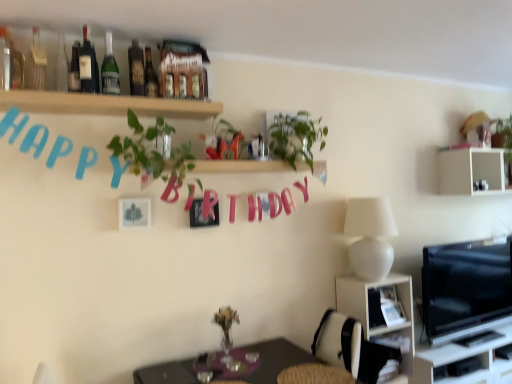
Find the location of a particular element. green leafy plant at upper center is located at coordinates (295, 137).

What do you see at coordinates (11, 62) in the screenshot? This screenshot has height=384, width=512. I see `matte glass bottle at upper left, the 8th bottle when ordered from right to left` at bounding box center [11, 62].

The height and width of the screenshot is (384, 512). In order to click on black glossy tv at right in this screenshot , I will do (x=466, y=287).

This screenshot has height=384, width=512. Identify the location of matte glass bottle at upper left, arranged as the 4th bottle when viewed from the right. (88, 66).

Measure the distance between point [88,84] and camera.

6.55 feet.

In order to click on matte black tv stand at right, which is the second shelf in right-to-left order in this screenshot , I will do `click(466, 359)`.

This screenshot has width=512, height=384. Find the location of `wooden table at lower center`. wooden table at lower center is located at coordinates 274,360.

You are a GUI agent. You are given a task and a screenshot of the screen. Output one action in this format:
    pyautogui.click(x=<x>, y=<y>)
    Task: Click on the white plastic shelf at lower right, acting as the second shelf starting from the left
    The height and width of the screenshot is (384, 512).
    Given the screenshot: What is the action you would take?
    pyautogui.click(x=382, y=313)

Which object is closer to the camera taking this photo, matte black tv stand at right, the fourth shelf when ordered from top to bottom, or black glossy tv at right?

matte black tv stand at right, the fourth shelf when ordered from top to bottom, is in front.

Which is nearer, (472,369) or (426,335)?

The point (426,335) is closer to the camera.

Does matte black tv stand at right, acting as the third shelf starting from the left, appear on the right side of black glossy tv at right?

No, matte black tv stand at right, acting as the third shelf starting from the left, is not to the right of black glossy tv at right.

Find the location of a particular element. television behind the matte black tv stand at right, acting as the third shelf starting from the left is located at coordinates click(x=466, y=287).

From the image's perspective, starting from the shiny dark glass bottle at upper center, which is counted as the eighth bottle, starting from the left, which bottle is the 3rd one above? Please provide its 2D coordinates.

[(110, 69)]

From the image's perspective, does green glass bottle at upper left, which ranks as the 3th bottle in right-to-left order, appear higher than shiny dark glass bottle at upper center, which is counted as the eighth bottle, starting from the left?

Indeed, from the image's perspective, green glass bottle at upper left, which ranks as the 3th bottle in right-to-left order, is shown above shiny dark glass bottle at upper center, which is counted as the eighth bottle, starting from the left.

Which is more to the left, white plastic shelf at lower right, positioned as the 2th shelf in bottom-to-top order, or clear glass bottle at upper left, which is counted as the 6th bottle, starting from the right?

clear glass bottle at upper left, which is counted as the 6th bottle, starting from the right.

From the clear glass bottle at upper left, which is counted as the 6th bottle, starting from the right, count 1st shelfs backward and point to it. Please provide its 2D coordinates.

[(382, 313)]

From the image's perspective, is white plastic shelf at lower right, acting as the second shelf starting from the left, beneath clear glass bottle at upper left, which is counted as the 6th bottle, starting from the right?

Correct, white plastic shelf at lower right, acting as the second shelf starting from the left, appears lower than clear glass bottle at upper left, which is counted as the 6th bottle, starting from the right, in the image.

This screenshot has width=512, height=384. In the image, there is a matte glass bottle at upper left, the 4th bottle viewed from the left. What are the coordinates of `table below it (from the image's perspective)` in the screenshot? It's located at (274, 360).

Is matte glass bottle at upper left, the 4th bottle viewed from the left, oriented away from wooden table at lower center?

No, wooden table at lower center is not at the back of matte glass bottle at upper left, the 4th bottle viewed from the left.

From the image's perspective, who appears lower, matte glass bottle at upper left, which appears as the 5th bottle when viewed from the right, or wooden table at lower center?

wooden table at lower center is shown below in the image.

Is matte glass bottle at upper left, the 4th bottle viewed from the left, positioned beyond the bounds of wooden table at lower center?

Yes, matte glass bottle at upper left, the 4th bottle viewed from the left, is located beyond the bounds of wooden table at lower center.

Looking at their sizes, would you say matte glass bottle at upper left, the 8th bottle when ordered from right to left, is wider or thinner than clear glass bottle at upper left, the 7th bottle when ordered from right to left?

Considering their sizes, matte glass bottle at upper left, the 8th bottle when ordered from right to left, looks broader than clear glass bottle at upper left, the 7th bottle when ordered from right to left.

Which object is further away from the camera, matte glass bottle at upper left, the first bottle positioned from the left, or clear glass bottle at upper left, the 7th bottle when ordered from right to left?

Positioned behind is matte glass bottle at upper left, the first bottle positioned from the left.

Looking at this image, from a real-world perspective, is matte glass bottle at upper left, the 8th bottle when ordered from right to left, above or below clear glass bottle at upper left, the 7th bottle when ordered from right to left?

matte glass bottle at upper left, the 8th bottle when ordered from right to left, is situated higher than clear glass bottle at upper left, the 7th bottle when ordered from right to left, in the real world.

From the image's perspective, is matte glass bottle at upper left, the 8th bottle when ordered from right to left, above clear glass bottle at upper left, the 7th bottle when ordered from right to left?

Yes, from the image's perspective, matte glass bottle at upper left, the 8th bottle when ordered from right to left, is over clear glass bottle at upper left, the 7th bottle when ordered from right to left.

Based on the photo, from the image's perspective, who appears lower, white matte table lamp at right or white matte shelf at upper right, which ranks as the 1th shelf in right-to-left order?

white matte table lamp at right.

Is white matte table lamp at right bigger than white matte shelf at upper right, positioned as the 2th shelf in top-to-bottom order?

No, white matte table lamp at right is not bigger than white matte shelf at upper right, positioned as the 2th shelf in top-to-bottom order.

Is white matte table lamp at right positioned with its back to white matte shelf at upper right, which ranks as the 1th shelf in right-to-left order?

white matte table lamp at right is not turned away from white matte shelf at upper right, which ranks as the 1th shelf in right-to-left order.

Would you say white matte table lamp at right is inside or outside white matte shelf at upper right, the 3th shelf when ordered from bottom to top?

white matte table lamp at right is located beyond the bounds of white matte shelf at upper right, the 3th shelf when ordered from bottom to top.

Consider the image. Considering the sizes of objects green glass bottle at upper left, which ranks as the 3th bottle in right-to-left order, and green leafy plant at upper center in the image provided, who is smaller, green glass bottle at upper left, which ranks as the 3th bottle in right-to-left order, or green leafy plant at upper center?

With smaller size is green glass bottle at upper left, which ranks as the 3th bottle in right-to-left order.

Is green glass bottle at upper left, which appears as the 6th bottle when viewed from the left, positioned far away from green leafy plant at upper center?

green glass bottle at upper left, which appears as the 6th bottle when viewed from the left, is actually quite close to green leafy plant at upper center.

Is green glass bottle at upper left, which ranks as the 3th bottle in right-to-left order, turned away from green leafy plant at upper center?

No, green glass bottle at upper left, which ranks as the 3th bottle in right-to-left order, is not facing the opposite direction of green leafy plant at upper center.

Is green glass bottle at upper left, which ranks as the 3th bottle in right-to-left order, outside of green leafy plant at upper center?

green glass bottle at upper left, which ranks as the 3th bottle in right-to-left order, is positioned outside green leafy plant at upper center.

This screenshot has height=384, width=512. I want to click on television located on the right of matte black tv stand at right, which is the second shelf in right-to-left order, so click(466, 287).

From the image's perspective, which bottle is the 3rd one above the shiny dark glass bottle at upper center, which is counted as the eighth bottle, starting from the left? Please provide its 2D coordinates.

[(110, 69)]

When comparing their distances from matte glass bottle at upper left, which appears as the 5th bottle when viewed from the right, does matte black bottle at upper center, the second bottle viewed from the right, or wooden table at lower center seem further?

wooden table at lower center.

Which object lies nearer to the anchor point clear glass bottle at upper left, which is counted as the 6th bottle, starting from the right, white matte shelf at upper right, which ranks as the 4th shelf in left-to-right order, or wooden table at lower center?

wooden table at lower center.

Looking at the image, which one is located closer to white matte shelf at upper right, positioned as the 2th shelf in top-to-bottom order, matte glass bottle at upper left, which appears as the 5th bottle when viewed from the right, or wooden shelf at upper center, the 1th shelf when ordered from top to bottom?

Among the two, wooden shelf at upper center, the 1th shelf when ordered from top to bottom, is located nearer to white matte shelf at upper right, positioned as the 2th shelf in top-to-bottom order.

From the picture: Estimate the real-world distances between objects in this image. Which object is closer to wooden shelf at upper center, arranged as the 4th shelf when ordered from the bottom, clear glass bottle at upper left, the 7th bottle when ordered from right to left, or wooden table at lower center?

Among the two, clear glass bottle at upper left, the 7th bottle when ordered from right to left, is located nearer to wooden shelf at upper center, arranged as the 4th shelf when ordered from the bottom.

From the image, which object appears to be nearer to green glass bottle at upper left, which ranks as the 3th bottle in right-to-left order, wooden table at lower center or white matte shelf at upper right, which ranks as the 4th shelf in left-to-right order?

wooden table at lower center is positioned closer to the anchor green glass bottle at upper left, which ranks as the 3th bottle in right-to-left order.

Estimate the real-world distances between objects in this image. Which object is closer to green glass bottle at upper left, which appears as the 6th bottle when viewed from the left, matte glass bottle at upper left, the 4th bottle viewed from the left, or clear glass bottle at upper left, which is counted as the 6th bottle, starting from the right?

The object closer to green glass bottle at upper left, which appears as the 6th bottle when viewed from the left, is matte glass bottle at upper left, the 4th bottle viewed from the left.

Looking at the image, which one is located closer to matte glass bottle at upper left, which appears as the 5th bottle when viewed from the right, white plastic shelf at lower right, acting as the second shelf starting from the left, or matte glass bottle at upper left, the 8th bottle when ordered from right to left?

The object closer to matte glass bottle at upper left, which appears as the 5th bottle when viewed from the right, is matte glass bottle at upper left, the 8th bottle when ordered from right to left.

Based on their spatial positions, is shiny dark glass bottle at upper center, which is counted as the eighth bottle, starting from the left, or matte black tv stand at right, acting as the third shelf starting from the left, further from wooden shelf at upper center, which ranks as the 4th shelf in right-to-left order?

The object further to wooden shelf at upper center, which ranks as the 4th shelf in right-to-left order, is matte black tv stand at right, acting as the third shelf starting from the left.

The width and height of the screenshot is (512, 384). What are the coordinates of `plant between wooden table at lower center and matte black tv stand at right, which is the second shelf in right-to-left order, in the horizontal direction` in the screenshot? It's located at (295, 137).

The image size is (512, 384). In order to click on plant located between matte glass bottle at upper left, the 5th bottle when ordered from left to right, and black glossy tv at right in the left-right direction in this screenshot , I will do `click(295, 137)`.

Where is `table lamp between metallic silver picture frame at center and black glossy tv at right from left to right`? The height and width of the screenshot is (384, 512). table lamp between metallic silver picture frame at center and black glossy tv at right from left to right is located at coordinates (370, 236).

Locate an element on the screen. table between wooden shelf at upper center, the first shelf when ordered from left to right, and black glossy tv at right, in the horizontal direction is located at coordinates (274, 360).